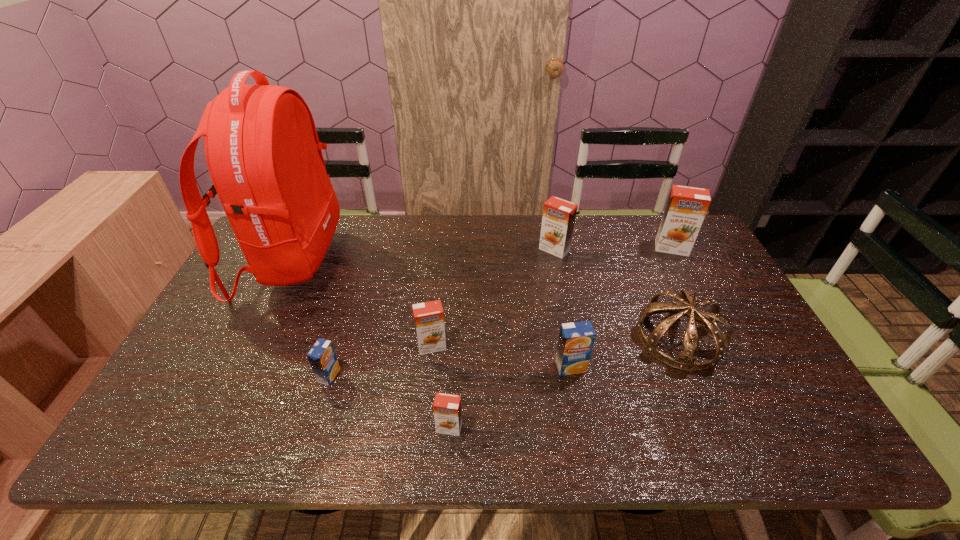
Where is `vacant space located 0.360m on the left of the left blue orange_juice`? This screenshot has height=540, width=960. vacant space located 0.360m on the left of the left blue orange_juice is located at coordinates (177, 375).

Where is `vacant space situated 0.150m on the right of the nearest orange orange juice`? Image resolution: width=960 pixels, height=540 pixels. vacant space situated 0.150m on the right of the nearest orange orange juice is located at coordinates (528, 428).

Identify the location of backpack located at the far edge. (262, 149).

I want to click on object present at the near edge, so click(x=447, y=409).

The width and height of the screenshot is (960, 540). I want to click on object at the left edge, so click(x=262, y=149).

I want to click on orange juice that is at the right edge, so click(686, 207).

At what (x,y) coordinates should I click in order to perform the action: click on tiara present at the right edge. Please return your answer as a coordinate pair (x, y). This screenshot has width=960, height=540. Looking at the image, I should click on (685, 360).

You are a GUI agent. You are given a task and a screenshot of the screen. Output one action in this format:
    pyautogui.click(x=<x>, y=<y>)
    Task: Click on the object that is at the far left corner
    The width and height of the screenshot is (960, 540).
    Given the screenshot: What is the action you would take?
    pyautogui.click(x=262, y=149)

Where is `object positioned at the far right corner`? The image size is (960, 540). object positioned at the far right corner is located at coordinates (686, 207).

This screenshot has width=960, height=540. Identify the location of vacant space at the far edge of the desktop. (599, 233).